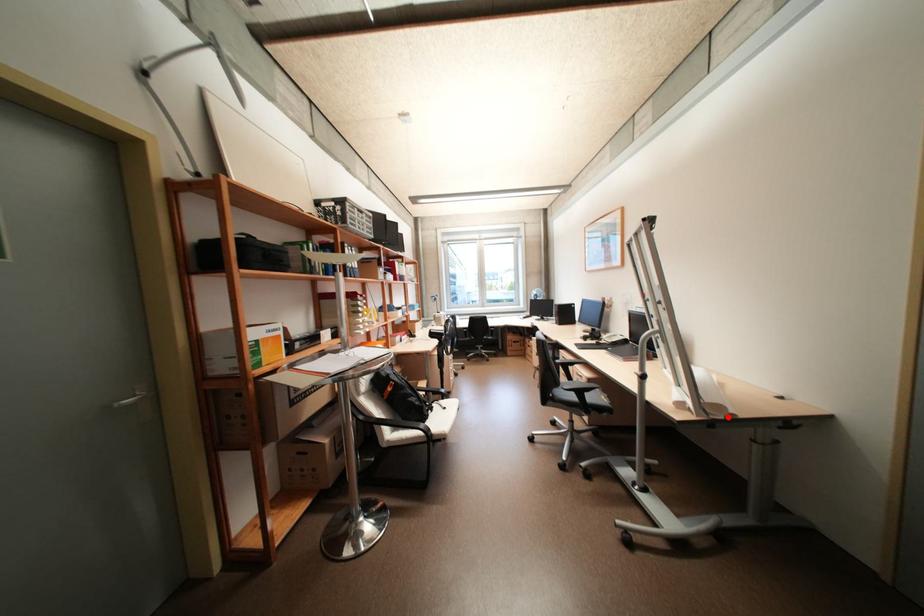
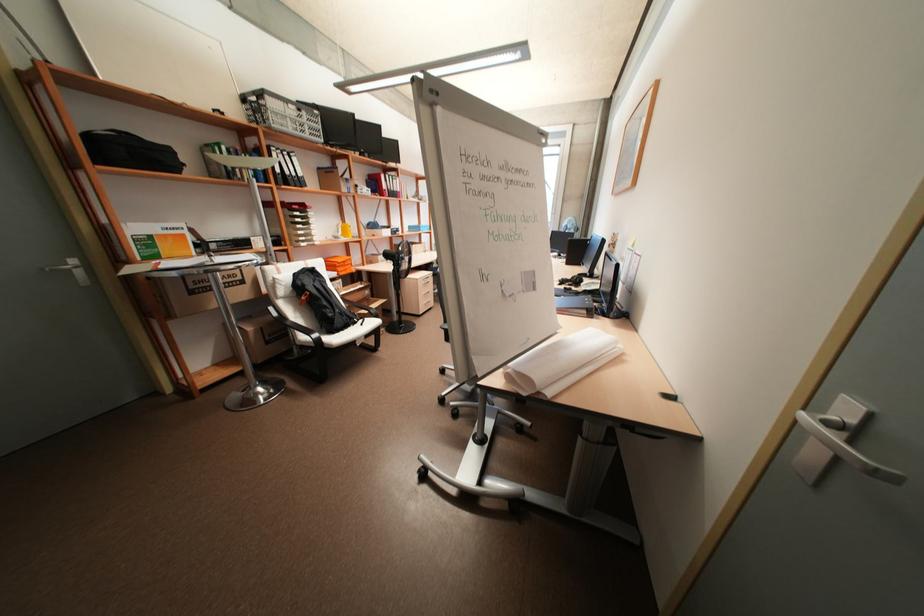
Find the pixel in the second image that matches the highlighted location in the first image.

(530, 394)